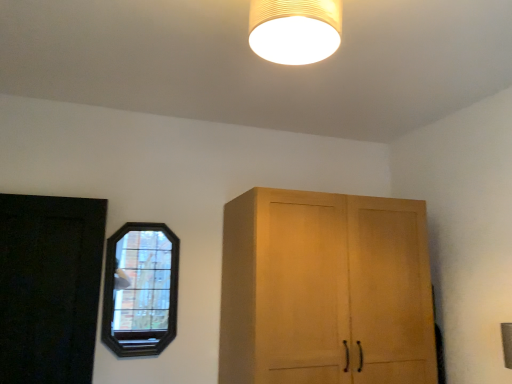
Question: From the image's perspective, is dark wood stained window at left above black matte door at left?

Choices:
 (A) yes
 (B) no

Answer: (B)

Question: Is dark wood stained window at left surrounding black matte door at left?

Choices:
 (A) yes
 (B) no

Answer: (B)

Question: Is dark wood stained window at left located outside black matte door at left?

Choices:
 (A) no
 (B) yes

Answer: (B)

Question: Is dark wood stained window at left in contact with black matte door at left?

Choices:
 (A) no
 (B) yes

Answer: (A)

Question: Considering the relative positions of dark wood stained window at left and black matte door at left in the image provided, is dark wood stained window at left to the right of black matte door at left from the viewer's perspective?

Choices:
 (A) no
 (B) yes

Answer: (B)

Question: Considering the relative sizes of dark wood stained window at left and black matte door at left in the image provided, is dark wood stained window at left bigger than black matte door at left?

Choices:
 (A) yes
 (B) no

Answer: (B)

Question: Is there a large distance between dark wood stained window at left and matte beige lampshade at upper center?

Choices:
 (A) yes
 (B) no

Answer: (A)

Question: Considering the relative positions of dark wood stained window at left and matte beige lampshade at upper center in the image provided, is dark wood stained window at left to the right of matte beige lampshade at upper center from the viewer's perspective?

Choices:
 (A) yes
 (B) no

Answer: (B)

Question: Is matte beige lampshade at upper center at the back of dark wood stained window at left?

Choices:
 (A) yes
 (B) no

Answer: (B)

Question: Can you confirm if dark wood stained window at left is taller than matte beige lampshade at upper center?

Choices:
 (A) no
 (B) yes

Answer: (B)

Question: Could you tell me if dark wood stained window at left is facing matte beige lampshade at upper center?

Choices:
 (A) yes
 (B) no

Answer: (A)

Question: From the image's perspective, is dark wood stained window at left above matte beige lampshade at upper center?

Choices:
 (A) no
 (B) yes

Answer: (A)

Question: From a real-world perspective, is black matte door at left located higher than dark wood stained window at left?

Choices:
 (A) yes
 (B) no

Answer: (B)